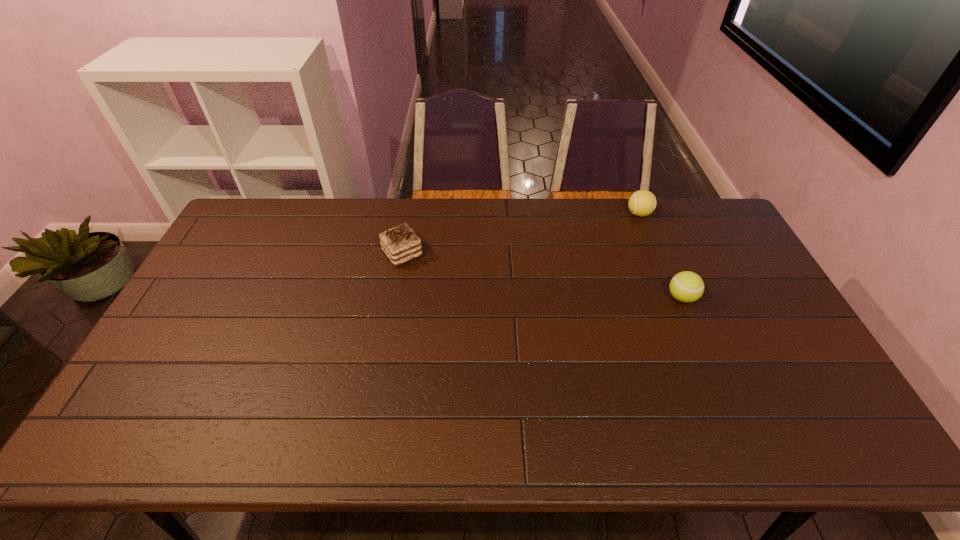
Image resolution: width=960 pixels, height=540 pixels. Find the location of `free point between the nearest object and the farthest object`. free point between the nearest object and the farthest object is located at coordinates (660, 256).

Find the location of a particular element. blank region between the farthest object and the nearer tennis ball is located at coordinates (660, 256).

Locate an element on the screen. The height and width of the screenshot is (540, 960). free space between the nearest object and the leftmost object is located at coordinates pyautogui.click(x=542, y=276).

At what (x,y) coordinates should I click in order to perform the action: click on vacant area between the nearer tennis ball and the farther tennis ball. Please return your answer as a coordinate pair (x, y). Looking at the image, I should click on (660, 256).

This screenshot has width=960, height=540. Identify the location of free spot between the nearest object and the leftmost object. (542, 276).

Select which object appears as the second closest to the leftmost object. Please provide its 2D coordinates. Your answer should be formatted as a tuple, i.e. [(x, y)], where the tuple contains the x and y coordinates of a point satisfying the conditions above.

[(686, 286)]

Select which object appears as the closest to the leftmost object. Please provide its 2D coordinates. Your answer should be formatted as a tuple, i.e. [(x, y)], where the tuple contains the x and y coordinates of a point satisfying the conditions above.

[(642, 203)]

Locate an element on the screen. This screenshot has height=540, width=960. vacant area in the image that satisfies the following two spatial constraints: 1. on the front side of the second farthest object; 2. on the right side of the nearer tennis ball is located at coordinates (395, 298).

What are the coordinates of `free region that satisfies the following two spatial constraints: 1. on the back side of the chocolate cake; 2. on the left side of the farther tennis ball` in the screenshot? It's located at (410, 214).